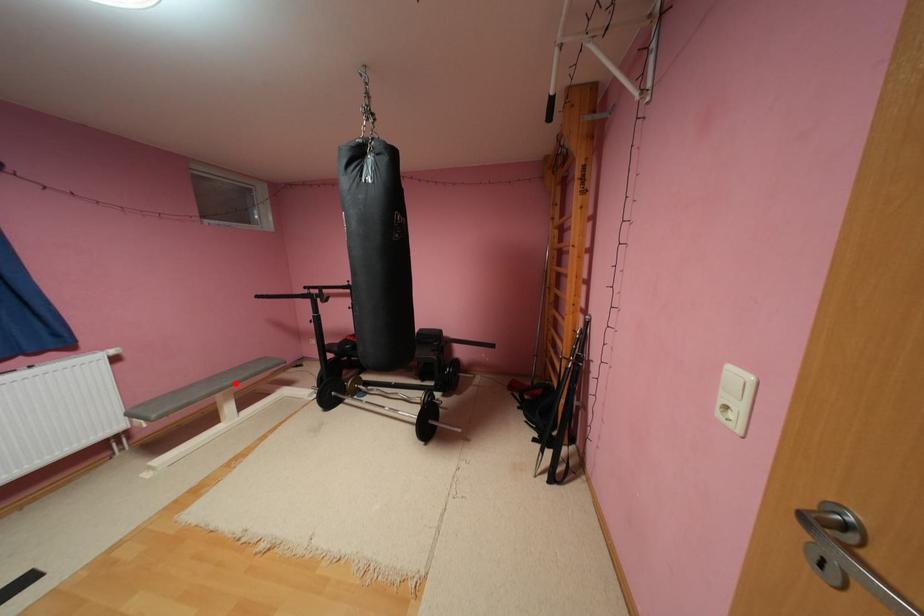
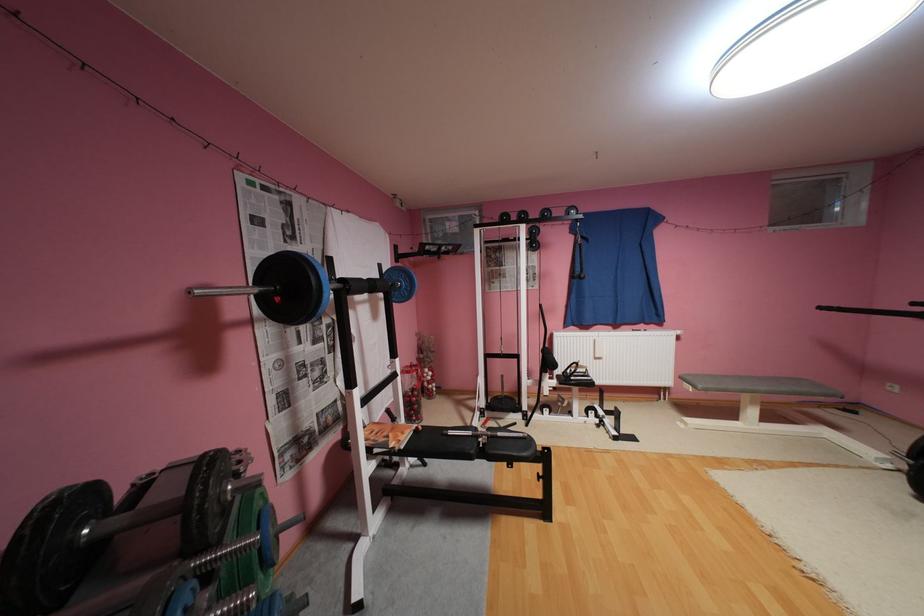
Locate, in the second image, the point that corresponds to the highlighted location in the first image.

(771, 387)